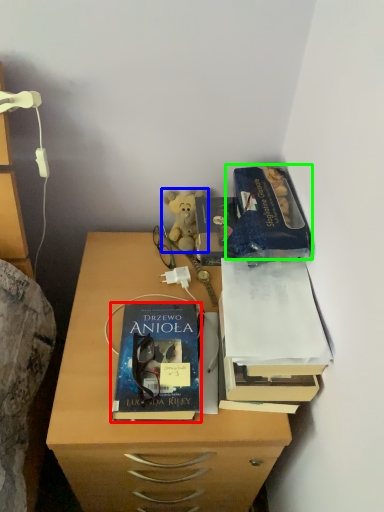
Question: Based on their relative distances, which object is nearer to book (highlighted by a red box)? Choose from teddy bear (highlighted by a blue box) and paperback book (highlighted by a green box).

Choices:
 (A) teddy bear
 (B) paperback book

Answer: (B)